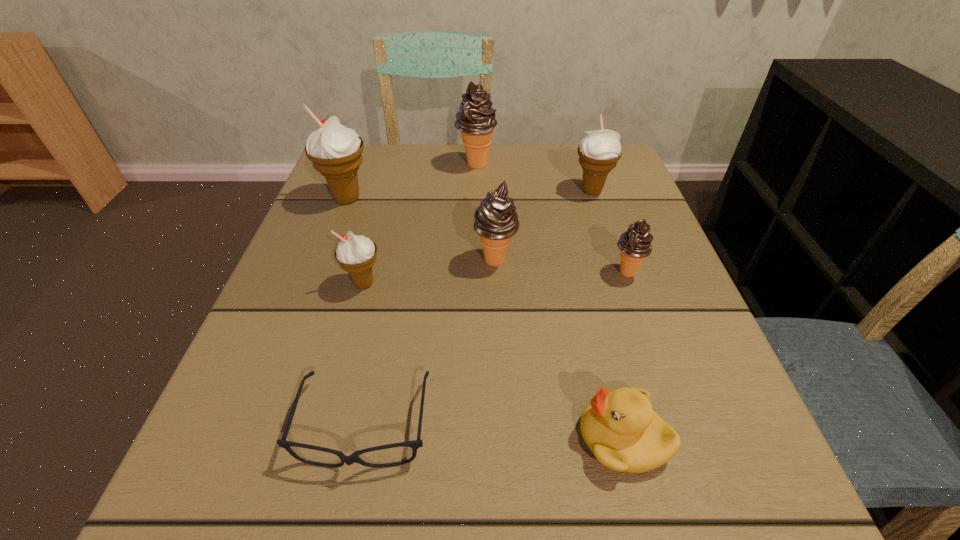
The height and width of the screenshot is (540, 960). Identify the location of spectacles located at the near edge. (415, 444).

This screenshot has width=960, height=540. What are the coordinates of `spectacles that is positioned at the left edge` in the screenshot? It's located at (415, 444).

Identify the location of duckling present at the right edge. (620, 428).

This screenshot has width=960, height=540. In order to click on object that is at the far left corner in this screenshot , I will do `click(336, 151)`.

Identify the location of object at the near left corner. The height and width of the screenshot is (540, 960). (415, 444).

Image resolution: width=960 pixels, height=540 pixels. Find the location of `object that is positioned at the far right corner`. object that is positioned at the far right corner is located at coordinates (599, 152).

The image size is (960, 540). I want to click on object that is positioned at the near right corner, so click(620, 428).

In the image, there is a desktop. Where is `vacant region at the far edge`? This screenshot has height=540, width=960. vacant region at the far edge is located at coordinates (406, 194).

The height and width of the screenshot is (540, 960). Find the location of `vacant space at the left edge of the desktop`. vacant space at the left edge of the desktop is located at coordinates (316, 217).

In the image, there is a desktop. Where is `blank space at the right edge`? The width and height of the screenshot is (960, 540). blank space at the right edge is located at coordinates (597, 227).